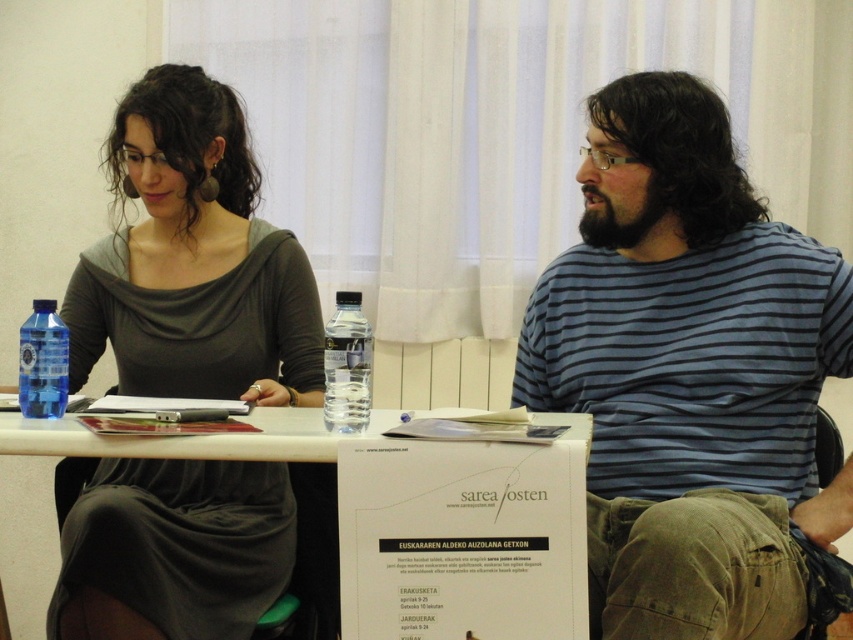
You are organizing a small event and need to arrange items on a shelf. The shelf has limited vertical space. You have the matte gray dress at center and the transparent plastic bottle at left. Which item should you place first to maximize shelf space?

The matte gray dress at center is taller than the transparent plastic bottle at left. To maximize shelf space, place the taller matte gray dress at center first, then the shorter transparent plastic bottle at left on top of it.

You are organizing a meeting and need to place a name tag on the table. The name tag is the same size as the transparent plastic bottle at left. Where should you place it so that it doesn not block the white paperboard at center?

Place the name tag near the edge of the table away from the white paperboard at center since the transparent plastic bottle at left is smaller and the name tag, being the same size, won not obstruct the larger white paperboard at center.